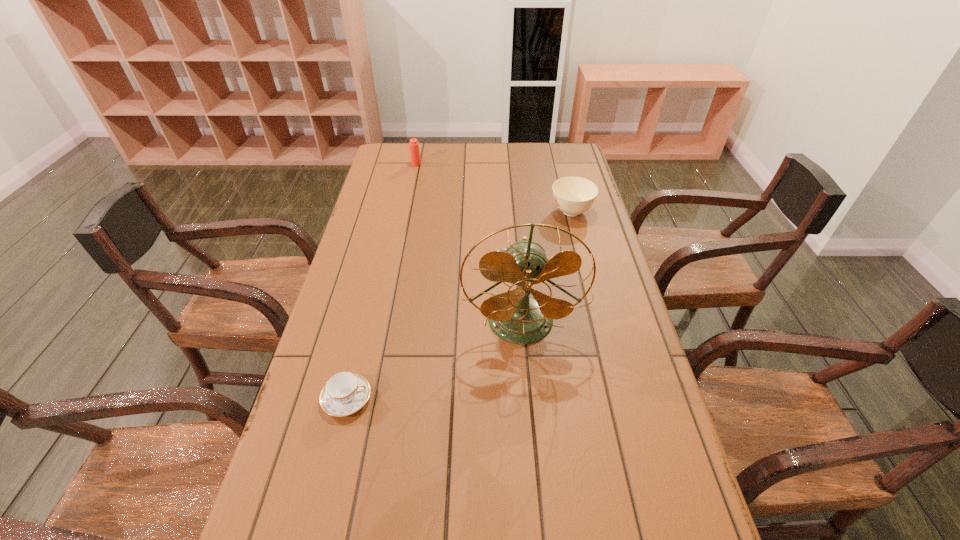
This screenshot has width=960, height=540. I want to click on fan, so click(514, 316).

Where is `the tallest object`? the tallest object is located at coordinates (514, 316).

In order to click on Tabasco sauce in this screenshot , I will do `click(413, 144)`.

This screenshot has height=540, width=960. In order to click on the farthest object in this screenshot , I will do `click(413, 144)`.

At what (x,y) coordinates should I click in order to perform the action: click on sugar bowl. Please return your answer as a coordinate pair (x, y). The width and height of the screenshot is (960, 540). Looking at the image, I should click on (572, 195).

Where is `the third nearest object`? The width and height of the screenshot is (960, 540). the third nearest object is located at coordinates (572, 195).

Locate an element on the screen. The height and width of the screenshot is (540, 960). the nearest object is located at coordinates (345, 393).

Identify the location of the shortest object. (345, 393).

You are a GUI agent. You are given a task and a screenshot of the screen. Output one action in this format:
    pyautogui.click(x=<x>, y=<y>)
    Task: Click on the vacant space located in front of the fan, directing air flow
    This screenshot has height=540, width=960.
    Given the screenshot: What is the action you would take?
    pyautogui.click(x=525, y=369)

This screenshot has width=960, height=540. I want to click on free space located on the right of the Tabasco sauce, so click(x=448, y=164).